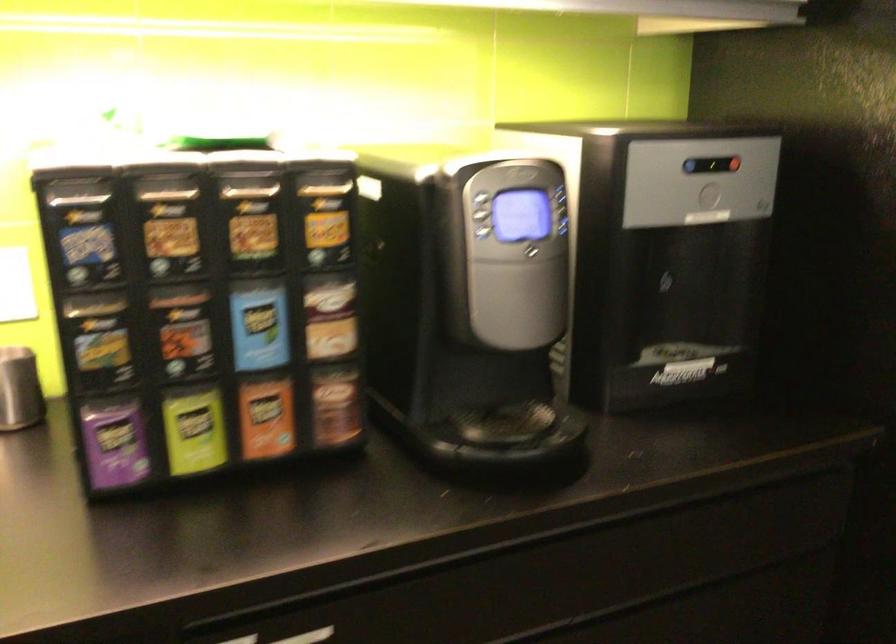
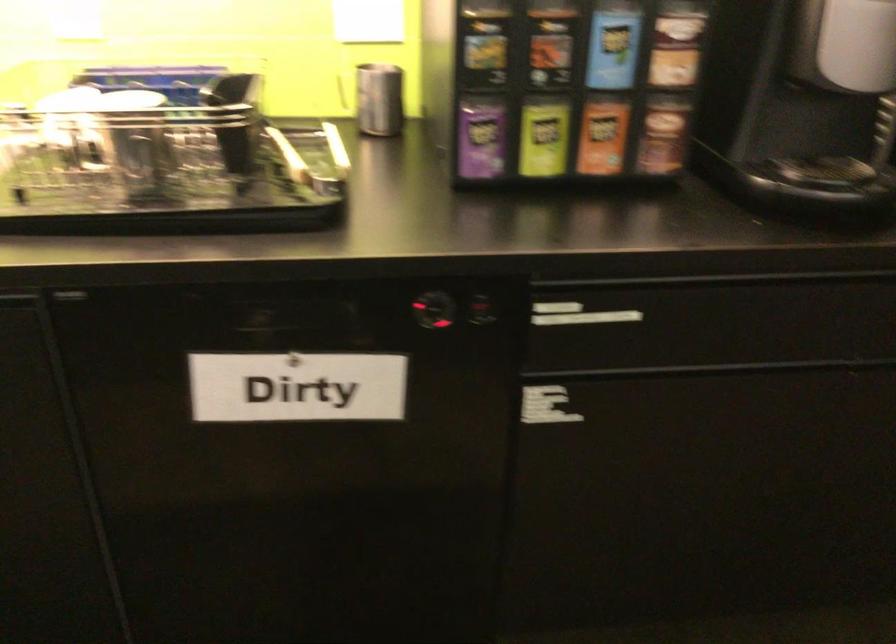
The point at (116, 442) is marked in the first image. Where is the corresponding point in the second image?

(479, 138)